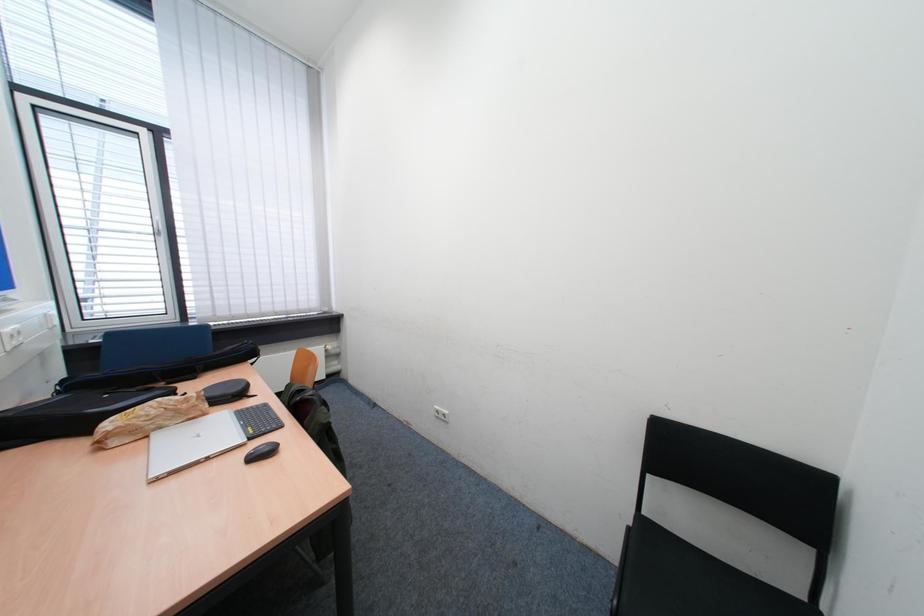
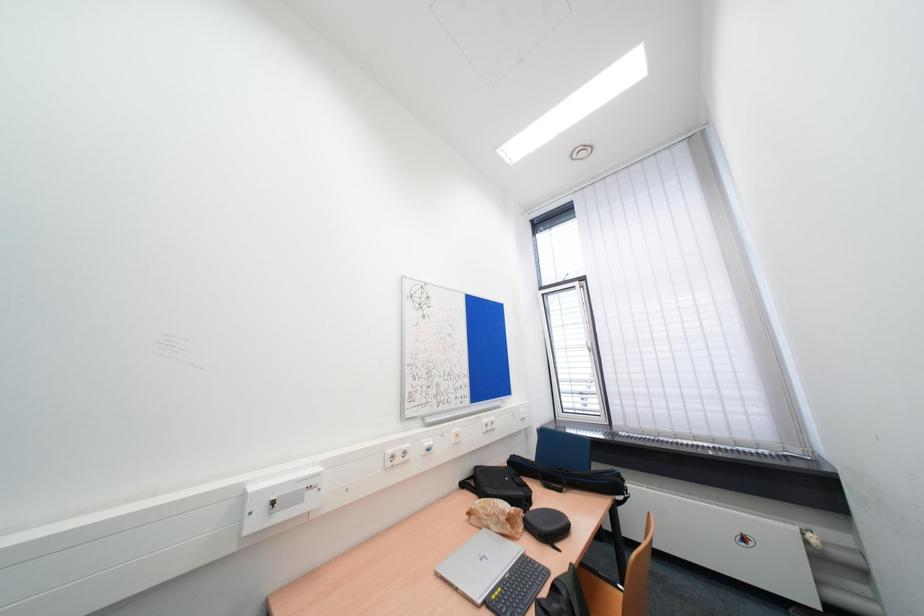
Question: The camera is either moving clockwise (left) or counter-clockwise (right) around the object. The first image is from the beginning of the video and the second image is from the end. Is the camera moving left or right when shooting the video?

Choices:
 (A) Left
 (B) Right

Answer: (B)